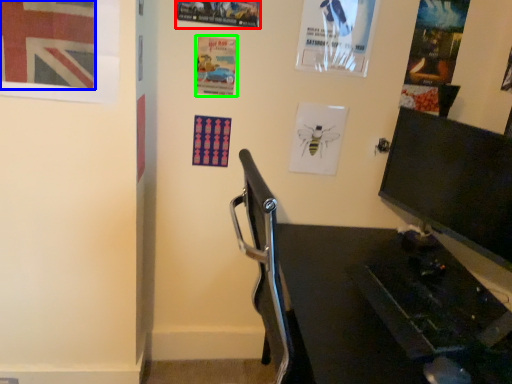
Question: Estimate the real-world distances between objects in this image. Which object is farther from poster page (highlighted by a red box), poster (highlighted by a blue box) or poster page (highlighted by a green box)?

Choices:
 (A) poster
 (B) poster page

Answer: (A)